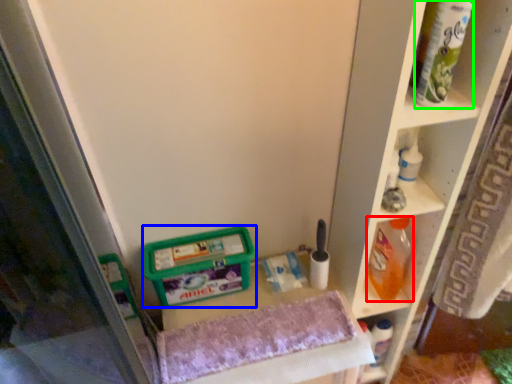
Question: Which object is the farthest from cleaning product (highlighted by a red box)? Choose among these: wide (highlighted by a blue box) or tube (highlighted by a green box).

Choices:
 (A) wide
 (B) tube

Answer: (B)